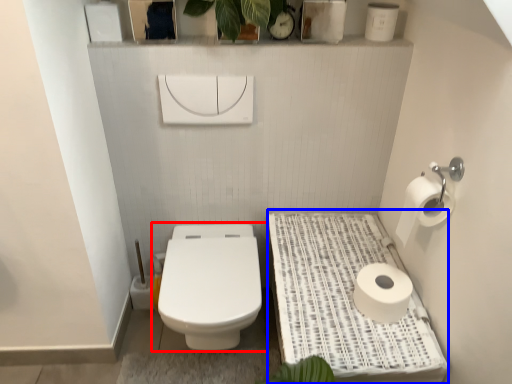
Question: Which object appears farthest to the camera in this image, toilet (highlighted by a red box) or table (highlighted by a blue box)?

Choices:
 (A) toilet
 (B) table

Answer: (A)